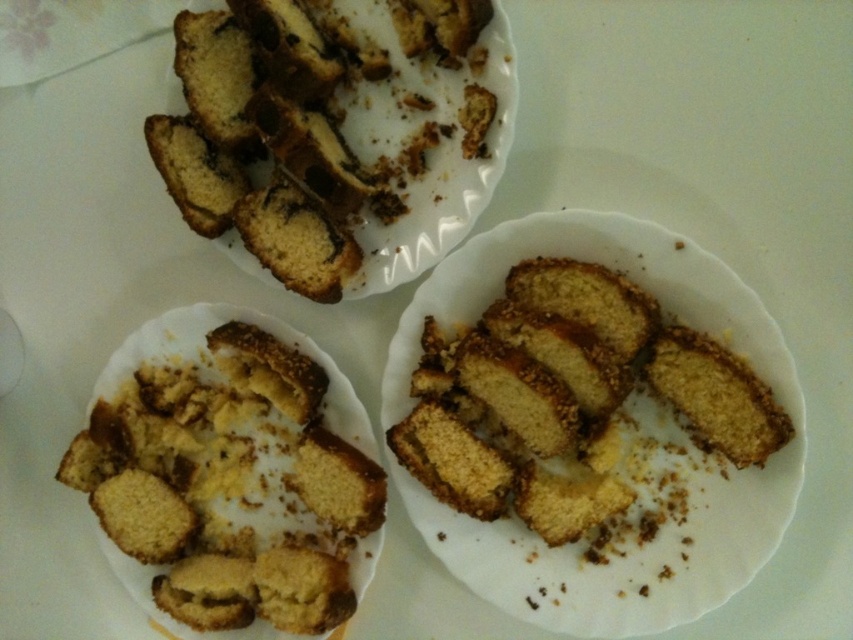
Question: Does golden crumbly muffin at lower left have a larger size compared to white matte plate at center?

Choices:
 (A) no
 (B) yes

Answer: (A)

Question: Estimate the real-world distances between objects in this image. Which object is closer to the white matte plate at center?

Choices:
 (A) golden crumbly muffin at lower left
 (B) golden crumbly cake at center

Answer: (B)

Question: Is the position of golden crumbly muffin at lower left more distant than that of white matte plate at center?

Choices:
 (A) yes
 (B) no

Answer: (A)

Question: Which object is closer to the camera taking this photo?

Choices:
 (A) golden crumbly muffin at lower left
 (B) golden crumbly cake at center

Answer: (B)

Question: Is golden crumbly muffin at lower left wider than white matte plate at center?

Choices:
 (A) no
 (B) yes

Answer: (A)

Question: Which point appears closest to the camera in this image?

Choices:
 (A) (247, 467)
 (B) (689, 417)

Answer: (B)